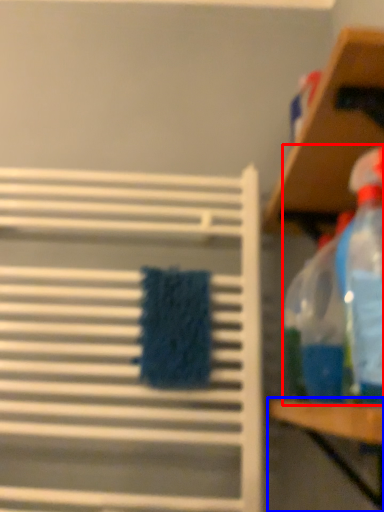
Question: Which object appears closest to the camera in this image, cleaning product (highlighted by a red box) or table (highlighted by a blue box)?

Choices:
 (A) cleaning product
 (B) table

Answer: (B)